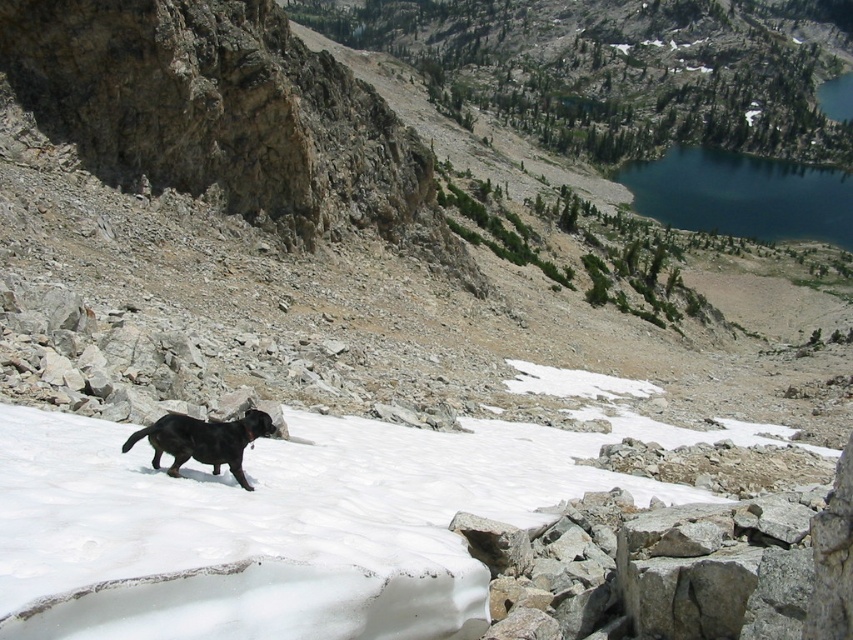
Based on the photo, which is more to the left, white powdery snow at center or shiny black dog at lower left?

shiny black dog at lower left is more to the left.

Is white powdery snow at center positioned behind shiny black dog at lower left?

No, white powdery snow at center is closer to the viewer.

The height and width of the screenshot is (640, 853). Identify the location of white powdery snow at center. pyautogui.click(x=283, y=525).

Can you confirm if white powdery snow at center is positioned below deep blue water at upper right?

Indeed, white powdery snow at center is positioned under deep blue water at upper right.

Does white powdery snow at center have a greater height compared to deep blue water at upper right?

No.

Which is in front, point (264, 566) or point (694, 225)?

Point (264, 566) is more forward.

Where is `white powdery snow at center`? The width and height of the screenshot is (853, 640). white powdery snow at center is located at coordinates (283, 525).

This screenshot has width=853, height=640. Describe the element at coordinates (741, 195) in the screenshot. I see `deep blue water at upper right` at that location.

Is deep blue water at upper right bigger than shiny black dog at lower left?

Correct, deep blue water at upper right is larger in size than shiny black dog at lower left.

Measure the distance between deep blue water at upper right and camera.

They are 319.22 meters apart.

This screenshot has width=853, height=640. In order to click on deep blue water at upper right in this screenshot , I will do tap(741, 195).